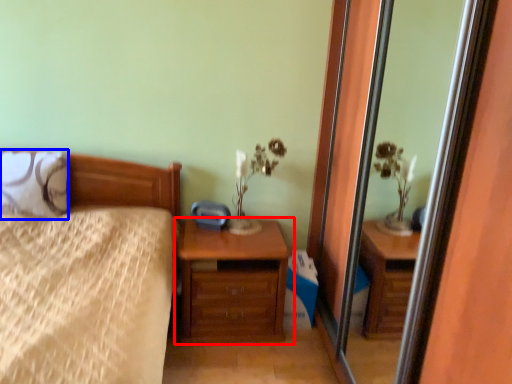
Question: Which of the following is the farthest to the observer, chest of drawers (highlighted by a red box) or pillow (highlighted by a blue box)?

Choices:
 (A) chest of drawers
 (B) pillow

Answer: (A)